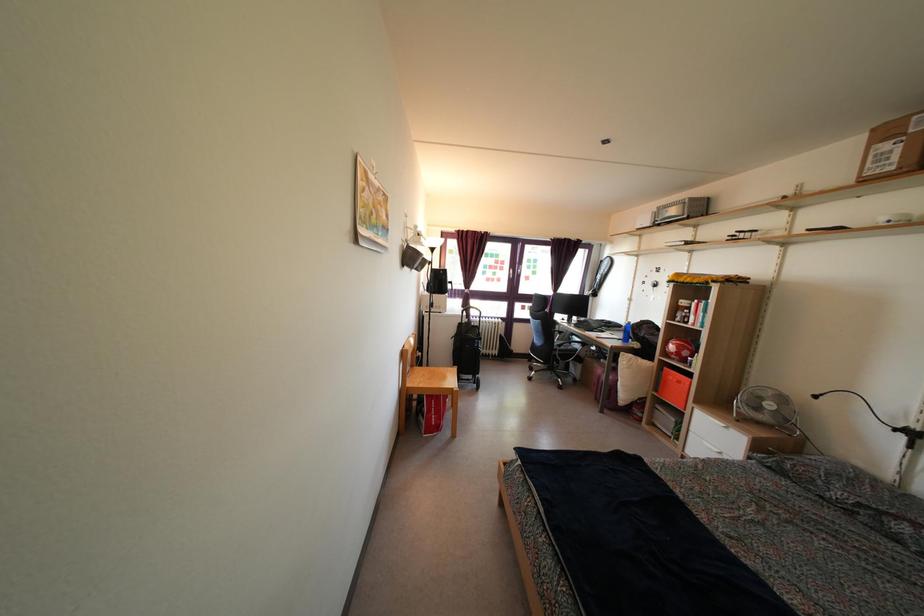
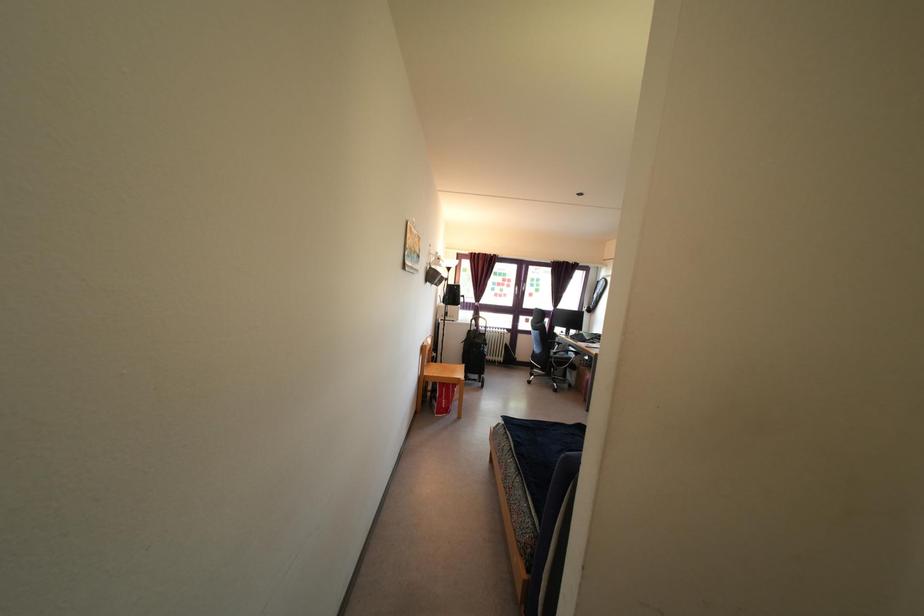
Question: I am providing you with two images of the same scene from different viewpoints. Please identify which objects are invisible in image2.

Choices:
 (A) black trolley handle
 (B) sofa sitting surface
 (C) chair armrest
 (D) none of these

Answer: (D)